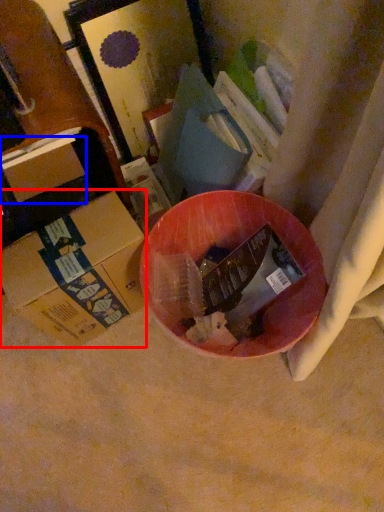
Question: Which point is further to the camera, box (highlighted by a red box) or box (highlighted by a blue box)?

Choices:
 (A) box
 (B) box

Answer: (B)